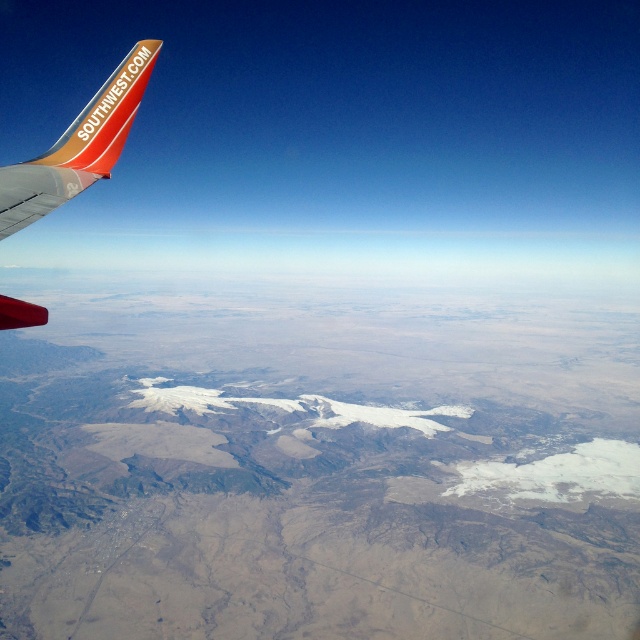
You are a pilot looking at the landscape through the airplane window. You notice two points on the wing labeled as point (80, 116) and point (108, 108). Which point is nearer to you?

Point (80, 116) is closer to the viewer than point (108, 108).

You are a passenger on the plane and want to know if the matte orange winglet at upper left is closer to you than the orange matte airplane winglet at upper left. Can you determine this based on the view from your window?

The matte orange winglet at upper left is in front of the orange matte airplane winglet at upper left, so it is closer to you.